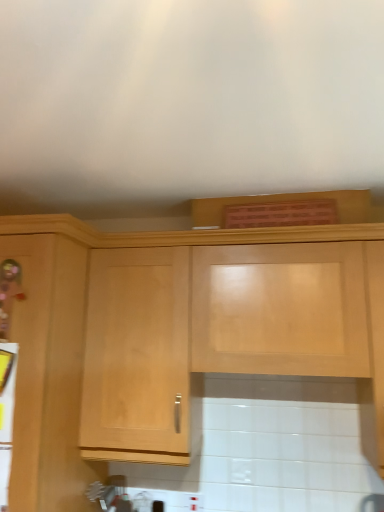
Question: Can light wood cabinet at upper center be found inside metallic silver toaster at lower left?

Choices:
 (A) yes
 (B) no

Answer: (B)

Question: Can you see metallic silver toaster at lower left touching light wood cabinet at upper center?

Choices:
 (A) yes
 (B) no

Answer: (B)

Question: Is metallic silver toaster at lower left wider than light wood cabinet at upper center?

Choices:
 (A) yes
 (B) no

Answer: (B)

Question: Considering the relative sizes of metallic silver toaster at lower left and light wood cabinet at upper center in the image provided, is metallic silver toaster at lower left smaller than light wood cabinet at upper center?

Choices:
 (A) no
 (B) yes

Answer: (B)

Question: Does metallic silver toaster at lower left have a lesser width compared to light wood cabinet at upper center?

Choices:
 (A) yes
 (B) no

Answer: (A)

Question: Are metallic silver toaster at lower left and light wood cabinet at upper center far apart?

Choices:
 (A) yes
 (B) no

Answer: (B)

Question: Is metallic silver toaster at lower left a part of light wood cabinet at upper center?

Choices:
 (A) yes
 (B) no

Answer: (B)

Question: Does light wood cabinet at upper center have a greater width compared to metallic silver toaster at lower left?

Choices:
 (A) no
 (B) yes

Answer: (B)

Question: Can you confirm if light wood cabinet at upper center is bigger than metallic silver toaster at lower left?

Choices:
 (A) no
 (B) yes

Answer: (B)

Question: Is light wood cabinet at upper center shorter than metallic silver toaster at lower left?

Choices:
 (A) yes
 (B) no

Answer: (B)

Question: Is light wood cabinet at upper center closer to camera compared to metallic silver toaster at lower left?

Choices:
 (A) yes
 (B) no

Answer: (A)

Question: Is light wood cabinet at upper center positioned beyond the bounds of metallic silver toaster at lower left?

Choices:
 (A) no
 (B) yes

Answer: (B)

Question: From their relative heights in the image, would you say metallic silver toaster at lower left is taller or shorter than light wood cabinet at upper center?

Choices:
 (A) tall
 (B) short

Answer: (B)